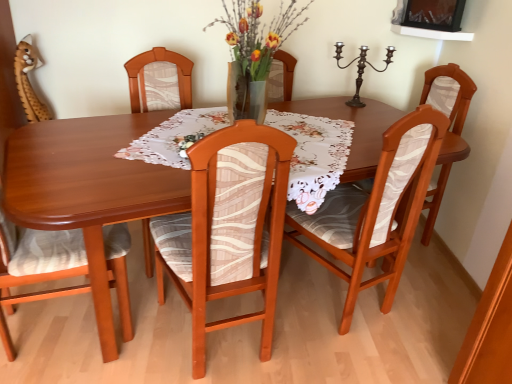
This screenshot has width=512, height=384. What are the coordinates of `free spot in front of wooden chair at right, which is the 1th chair from right to left` in the screenshot? It's located at (429, 291).